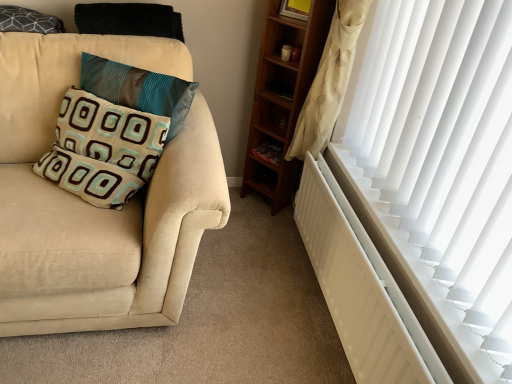
Question: Does teal fabric pillow at left, the second pillow when ordered from bottom to top, lie behind wooden bookshelf at center?

Choices:
 (A) yes
 (B) no

Answer: (B)

Question: Is wooden bookshelf at center located within teal fabric pillow at left, which is the second pillow in top-to-bottom order?

Choices:
 (A) no
 (B) yes

Answer: (A)

Question: Does teal fabric pillow at left, which is the second pillow in top-to-bottom order, have a greater width compared to wooden bookshelf at center?

Choices:
 (A) no
 (B) yes

Answer: (B)

Question: From a real-world perspective, is teal fabric pillow at left, which is the second pillow in top-to-bottom order, physically below wooden bookshelf at center?

Choices:
 (A) yes
 (B) no

Answer: (B)

Question: Considering the relative positions of teal fabric pillow at left, which is the second pillow in top-to-bottom order, and wooden bookshelf at center in the image provided, is teal fabric pillow at left, which is the second pillow in top-to-bottom order, to the right of wooden bookshelf at center from the viewer's perspective?

Choices:
 (A) yes
 (B) no

Answer: (B)

Question: Considering the positions of dark gray textured pillow at upper left, which ranks as the first pillow in top-to-bottom order, and suede beige couch at left in the image, is dark gray textured pillow at upper left, which ranks as the first pillow in top-to-bottom order, bigger or smaller than suede beige couch at left?

Choices:
 (A) small
 (B) big

Answer: (A)

Question: Looking at their shapes, would you say dark gray textured pillow at upper left, the 3th pillow when ordered from bottom to top, is wider or thinner than suede beige couch at left?

Choices:
 (A) wide
 (B) thin

Answer: (B)

Question: Is dark gray textured pillow at upper left, the 3th pillow when ordered from bottom to top, to the left or to the right of suede beige couch at left in the image?

Choices:
 (A) left
 (B) right

Answer: (A)

Question: Relative to suede beige couch at left, is dark gray textured pillow at upper left, which ranks as the first pillow in top-to-bottom order, in front or behind?

Choices:
 (A) behind
 (B) front

Answer: (A)

Question: Is suede beige couch at left to the left or to the right of teal fabric pillow at left, which is the second pillow in top-to-bottom order, in the image?

Choices:
 (A) left
 (B) right

Answer: (A)

Question: Considering the positions of suede beige couch at left and teal fabric pillow at left, the second pillow when ordered from bottom to top, in the image, is suede beige couch at left bigger or smaller than teal fabric pillow at left, the second pillow when ordered from bottom to top,?

Choices:
 (A) small
 (B) big

Answer: (B)

Question: Is point (70, 317) closer or farther from the camera than point (122, 64)?

Choices:
 (A) closer
 (B) farther

Answer: (A)

Question: Which is correct: suede beige couch at left is inside teal fabric pillow at left, the second pillow when ordered from bottom to top, or outside of it?

Choices:
 (A) inside
 (B) outside

Answer: (B)

Question: Considering the positions of beige fabric pillow at left, which is the first pillow in bottom-to-top order, and teal fabric pillow at left, the second pillow when ordered from bottom to top, in the image, is beige fabric pillow at left, which is the first pillow in bottom-to-top order, taller or shorter than teal fabric pillow at left, the second pillow when ordered from bottom to top,?

Choices:
 (A) short
 (B) tall

Answer: (A)

Question: Looking at the image, does beige fabric pillow at left, which is the first pillow in bottom-to-top order, seem bigger or smaller compared to teal fabric pillow at left, which is the second pillow in top-to-bottom order?

Choices:
 (A) small
 (B) big

Answer: (B)